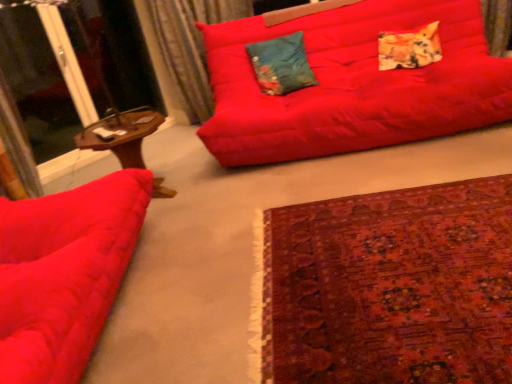
Question: Relative to matte red studio couch at upper center, acting as the first studio couch starting from the back, is transparent glass screen door at upper left in front or behind?

Choices:
 (A) front
 (B) behind

Answer: (B)

Question: From the image's perspective, is transparent glass screen door at upper left positioned above or below matte red studio couch at upper center, marked as the 2th studio couch in a left-to-right arrangement?

Choices:
 (A) above
 (B) below

Answer: (A)

Question: Estimate the real-world distances between objects in this image. Which object is farther from the woodenwoodentable at left?

Choices:
 (A) transparent glass screen door at upper left
 (B) carpet with intricate patterns at lower right
 (C) matte red studio couch at left, positioned as the second studio couch in right-to-left order
 (D) velvet curtain at upper left
 (E) teal floral cushion at center, which is the 2th pillow from right to left

Answer: (A)

Question: Based on their relative distances, which object is nearer to the velvet curtain at upper left?

Choices:
 (A) teal floral cushion at center, the first pillow in the left-to-right sequence
 (B) carpet with intricate patterns at lower right
 (C) matte red studio couch at left, positioned as the second studio couch in right-to-left order
 (D) matte red studio couch at upper center, placed as the second studio couch when sorted from front to back
 (E) transparent glass screen door at upper left

Answer: (A)